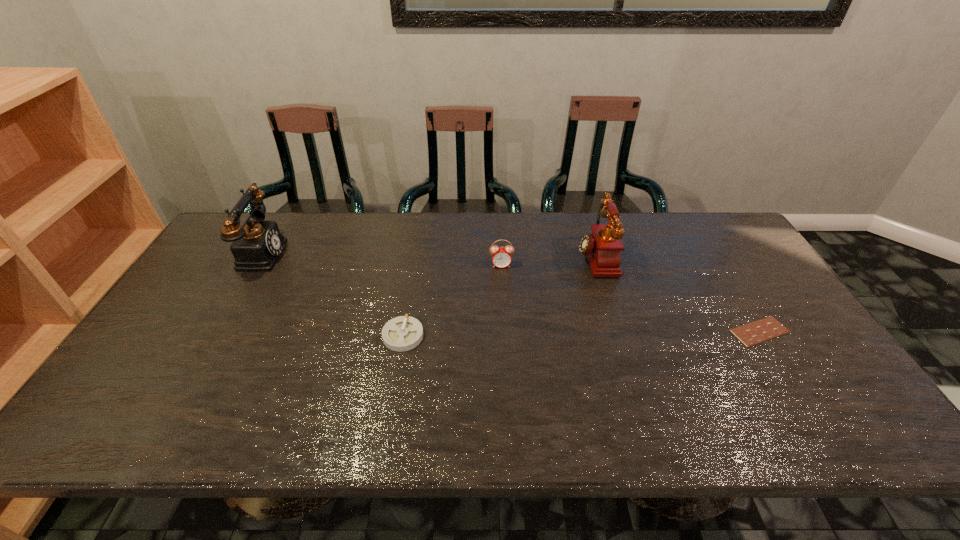
This screenshot has height=540, width=960. What are the coordinates of `vacant point at the right edge` in the screenshot? It's located at (758, 279).

This screenshot has height=540, width=960. What are the coordinates of `free space at the near left corner of the desktop` in the screenshot? It's located at (128, 407).

In the image, there is a desktop. Where is `vacant region at the far right corner`? The width and height of the screenshot is (960, 540). vacant region at the far right corner is located at coordinates (707, 234).

Locate an element on the screen. This screenshot has height=540, width=960. vacant area between the leftmost object and the third object from left to right is located at coordinates (380, 259).

Locate an element on the screen. This screenshot has height=540, width=960. unoccupied position between the chocolate bar and the left telephone is located at coordinates (509, 292).

Image resolution: width=960 pixels, height=540 pixels. Identify the location of free area in between the rightmost object and the second shortest object. (581, 334).

The width and height of the screenshot is (960, 540). Find the location of `free space between the leftmost object and the right telephone`. free space between the leftmost object and the right telephone is located at coordinates (426, 255).

At what (x,y) coordinates should I click in order to perform the action: click on free spot between the shortest object and the third object from right to left. Please return your answer as a coordinate pair (x, y). The width and height of the screenshot is (960, 540). Looking at the image, I should click on (631, 298).

Find the location of a particular element. The height and width of the screenshot is (540, 960). unoccupied area between the rightmost object and the second object from right to left is located at coordinates (677, 294).

Locate an element on the screen. The width and height of the screenshot is (960, 540). vacant space in between the chocolate bar and the third object from left to right is located at coordinates (631, 298).